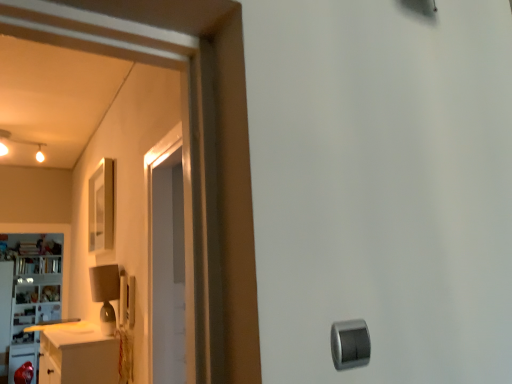
Question: Is silver metallic knob at lower right bigger than white glossy cabinet at left?

Choices:
 (A) yes
 (B) no

Answer: (B)

Question: Is silver metallic knob at lower right further to camera compared to white glossy cabinet at left?

Choices:
 (A) yes
 (B) no

Answer: (B)

Question: From a real-world perspective, is silver metallic knob at lower right under white glossy cabinet at left?

Choices:
 (A) no
 (B) yes

Answer: (B)

Question: From a real-world perspective, is silver metallic knob at lower right located higher than white glossy cabinet at left?

Choices:
 (A) no
 (B) yes

Answer: (A)

Question: Considering the relative sizes of silver metallic knob at lower right and white glossy cabinet at left in the image provided, is silver metallic knob at lower right wider than white glossy cabinet at left?

Choices:
 (A) yes
 (B) no

Answer: (B)

Question: Does silver metallic knob at lower right lie in front of white glossy cabinet at left?

Choices:
 (A) yes
 (B) no

Answer: (A)

Question: Is white glossy cabinet at left next to silver metallic knob at lower right?

Choices:
 (A) no
 (B) yes

Answer: (A)

Question: Is white glossy cabinet at left looking in the opposite direction of silver metallic knob at lower right?

Choices:
 (A) yes
 (B) no

Answer: (B)

Question: Is white glossy cabinet at left aimed at silver metallic knob at lower right?

Choices:
 (A) yes
 (B) no

Answer: (A)

Question: Is white glossy cabinet at left located outside silver metallic knob at lower right?

Choices:
 (A) yes
 (B) no

Answer: (A)

Question: Can you confirm if white glossy cabinet at left is smaller than silver metallic knob at lower right?

Choices:
 (A) no
 (B) yes

Answer: (A)

Question: From the image's perspective, is white glossy cabinet at left over silver metallic knob at lower right?

Choices:
 (A) no
 (B) yes

Answer: (A)

Question: Choose the correct answer: Is silver metallic knob at lower right inside white glossy cabinet at left or outside it?

Choices:
 (A) inside
 (B) outside

Answer: (B)